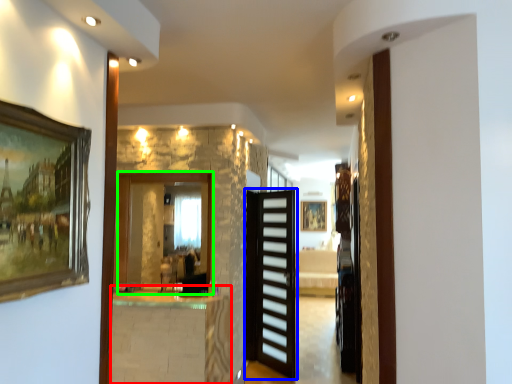
Question: Considering the real-world distances, which object is farthest from table (highlighted by a red box)? door (highlighted by a blue box) or mirror (highlighted by a green box)?

Choices:
 (A) door
 (B) mirror

Answer: (A)